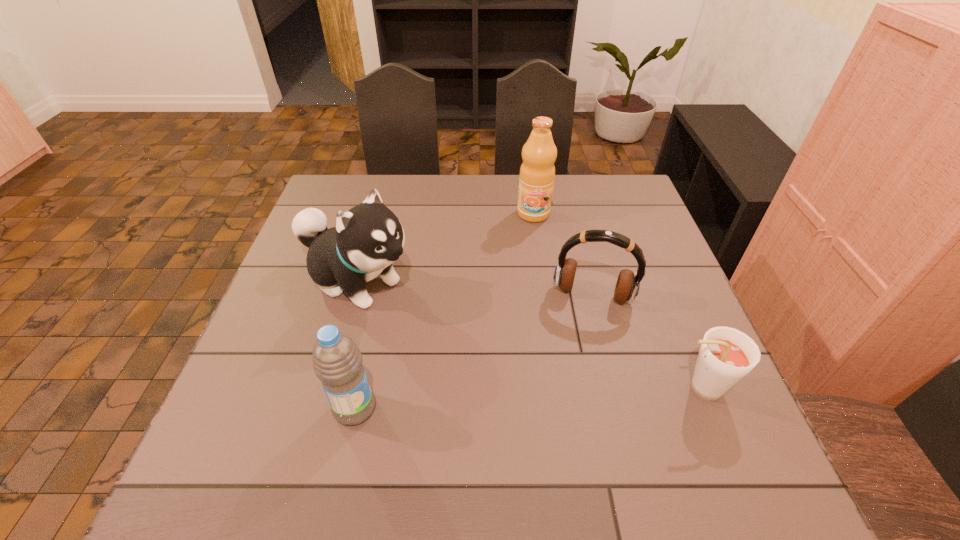
Select which object is the third closest to the puppy. Please provide its 2D coordinates. Your answer should be formatted as a tuple, i.e. [(x, y)], where the tuple contains the x and y coordinates of a point satisfying the conditions above.

[(627, 286)]

Where is `free space that satisfies the following two spatial constraints: 1. on the front side of the root beer; 2. on the drink side of the headset`? The image size is (960, 540). free space that satisfies the following two spatial constraints: 1. on the front side of the root beer; 2. on the drink side of the headset is located at coordinates (615, 388).

In order to click on vacant region that satisfies the following two spatial constraints: 1. on the back side of the water bottle; 2. on the drink side of the root beer in this screenshot , I will do `click(360, 388)`.